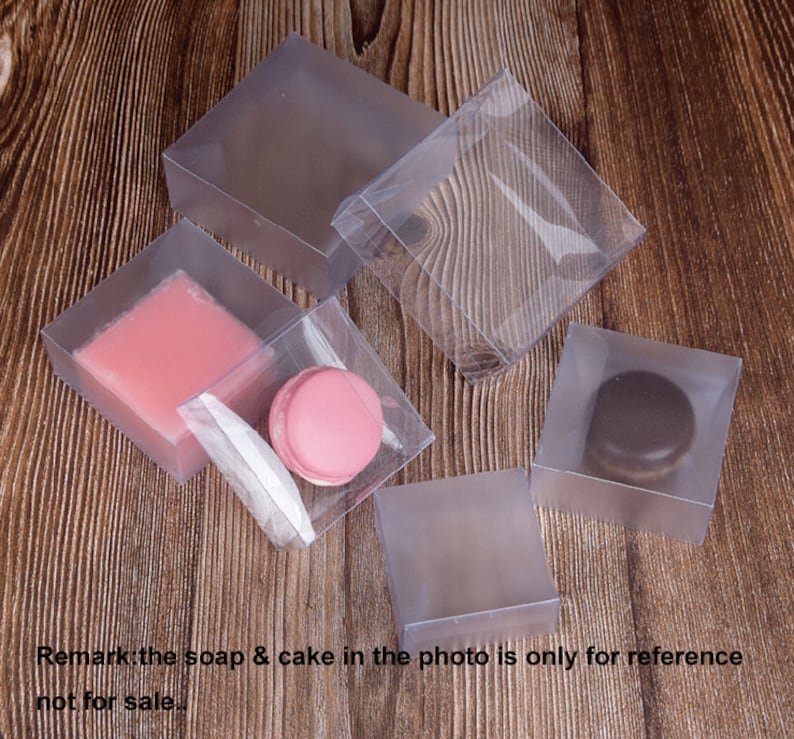
At what (x,y) coordinates should I click in order to perform the action: click on box. Please return your answer as a coordinate pair (x, y). The width and height of the screenshot is (794, 739). Looking at the image, I should click on click(x=441, y=579).